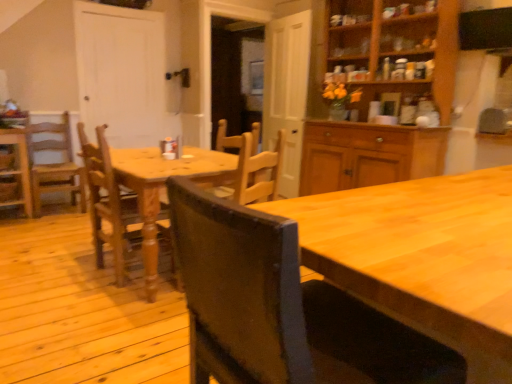
Question: Considering the relative positions of wooden chair at center, which is the fourth chair in back-to-front order, and light brown wooden chair at left, acting as the 4th chair starting from the front, in the image provided, is wooden chair at center, which is the fourth chair in back-to-front order, to the left of light brown wooden chair at left, acting as the 4th chair starting from the front, from the viewer's perspective?

Choices:
 (A) yes
 (B) no

Answer: (B)

Question: Does wooden chair at center, which is the fourth chair in back-to-front order, have a larger size compared to light brown wooden chair at left, arranged as the third chair when viewed from the right?

Choices:
 (A) yes
 (B) no

Answer: (B)

Question: From a real-world perspective, is wooden chair at center, the first chair from the front, located higher than light brown wooden chair at left, arranged as the third chair when viewed from the right?

Choices:
 (A) no
 (B) yes

Answer: (B)

Question: Is wooden chair at center, the first chair when ordered from right to left, oriented away from light brown wooden chair at left, the first chair positioned from the back?

Choices:
 (A) no
 (B) yes

Answer: (A)

Question: From the image's perspective, is wooden chair at center, which is the fourth chair in back-to-front order, over light brown wooden chair at left, arranged as the third chair when viewed from the right?

Choices:
 (A) yes
 (B) no

Answer: (B)

Question: Could light brown wooden chair at left, placed as the second chair when sorted from left to right, be considered to be inside wooden chair at center, which is the fourth chair in back-to-front order?

Choices:
 (A) no
 (B) yes

Answer: (A)

Question: Considering the relative sizes of light brown wooden chair at left, the first chair positioned from the back, and wooden chair at center, which appears as the second chair when viewed from the front, in the image provided, is light brown wooden chair at left, the first chair positioned from the back, wider than wooden chair at center, which appears as the second chair when viewed from the front,?

Choices:
 (A) yes
 (B) no

Answer: (A)

Question: Can you confirm if light brown wooden chair at left, the first chair positioned from the back, is thinner than wooden chair at center, which appears as the second chair when viewed from the front?

Choices:
 (A) yes
 (B) no

Answer: (B)

Question: Is wooden chair at center, which appears as the second chair when viewed from the front, at the back of light brown wooden chair at left, arranged as the third chair when viewed from the right?

Choices:
 (A) yes
 (B) no

Answer: (B)

Question: From a real-world perspective, is light brown wooden chair at left, the first chair positioned from the back, positioned over wooden chair at center, which appears as the 2th chair when viewed from the right, based on gravity?

Choices:
 (A) no
 (B) yes

Answer: (A)

Question: Is light brown wooden chair at left, acting as the 4th chair starting from the front, oriented towards wooden chair at center, which appears as the 2th chair when viewed from the right?

Choices:
 (A) no
 (B) yes

Answer: (B)

Question: From the image's perspective, is light brown wooden chair at left, the first chair positioned from the back, below wooden chair at center, placed as the third chair when sorted from left to right?

Choices:
 (A) yes
 (B) no

Answer: (B)

Question: Does wooden chair at center, which appears as the second chair when viewed from the front, have a smaller size compared to light brown wooden chair at left, the first chair positioned from the back?

Choices:
 (A) no
 (B) yes

Answer: (B)